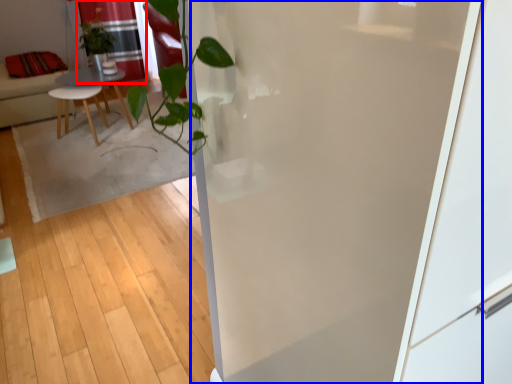
Question: Which object appears farthest to the camera in this image, curtain (highlighted by a red box) or screen door (highlighted by a blue box)?

Choices:
 (A) curtain
 (B) screen door

Answer: (A)